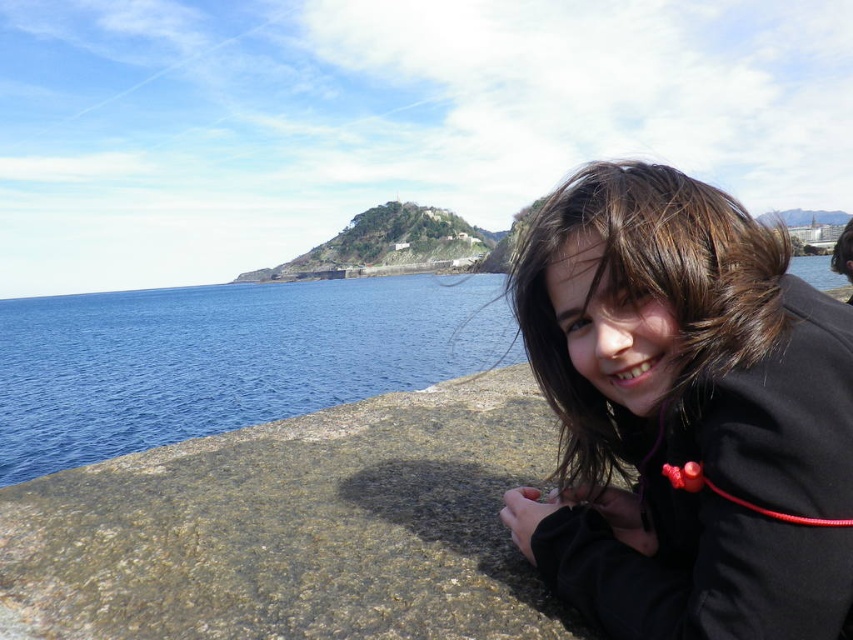
You are a photographer trying to capture the scene with a camera. You notice the black matte jacket at lower right and the brown hair at lower right in your viewfinder. Which object should you focus on first if you want to ensure both are in sharp focus, considering their sizes?

The black matte jacket at lower right has a smaller size compared to brown hair at lower right. To ensure both are in sharp focus, you should focus on the smaller object first, which is the black matte jacket at lower right, as smaller objects often require precise focus to capture details.

You are a photographer trying to capture the person in the scene. You notice the black matte jacket at lower right and the brown hair at lower right. Which object should you focus on first to ensure both are in sharp focus?

The black matte jacket at lower right is closer to the viewer than the brown hair at lower right. To ensure both are in sharp focus, focus on the black matte jacket at lower right first since it is closer, and the depth of field will naturally include the brown hair at lower right.

You are standing at the edge of the pier and want to hand a souvenir to a friend who is holding the black matte jacket at lower right. If your throwing range is up to 20 meters, can you reach them?

The black matte jacket at lower right is 18.07 meters from viewer. Since your throwing range is up to 20 meters, you can reach them.